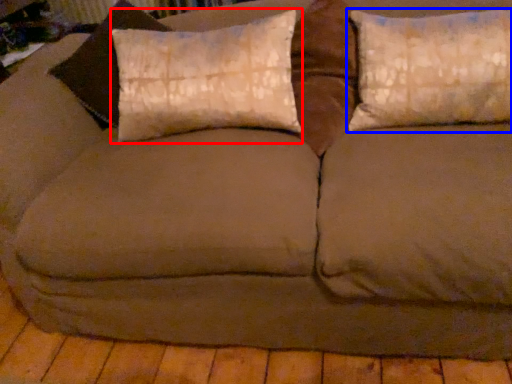
Question: Which point is further to the camera, pillow (highlighted by a red box) or pillow (highlighted by a blue box)?

Choices:
 (A) pillow
 (B) pillow

Answer: (A)